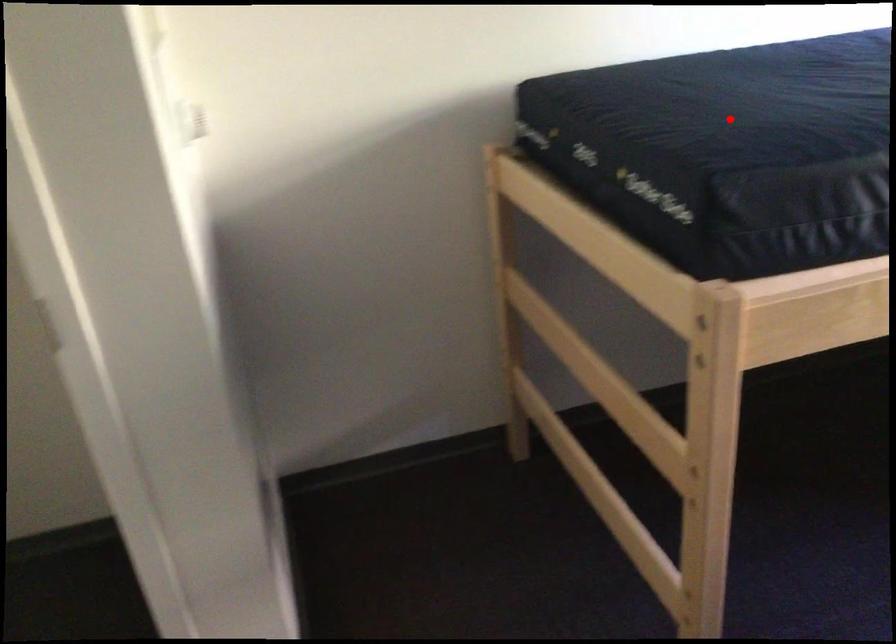
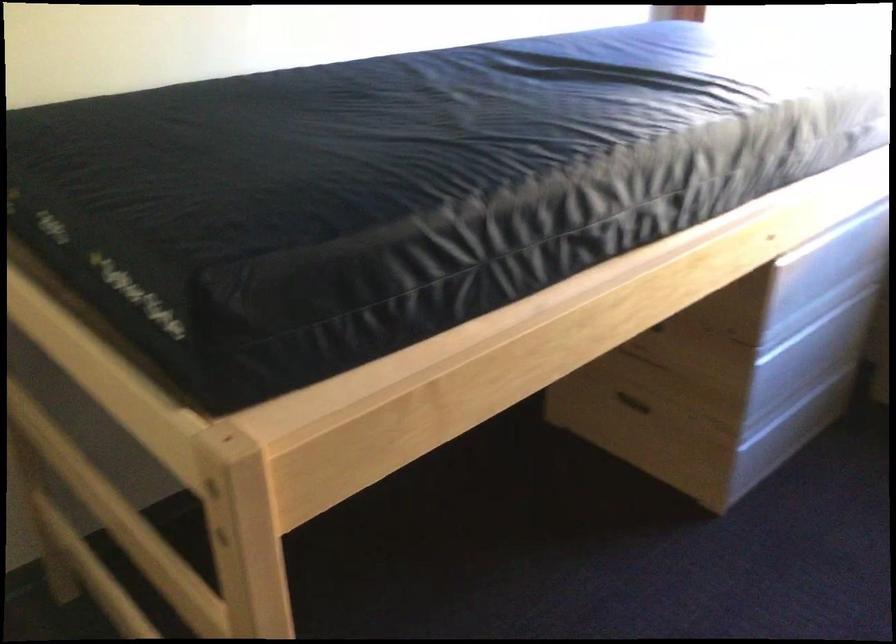
Question: I am providing you with two images of the same scene from different viewpoints. Given a red point in image1, look at the same physical point in image2. Is it:

Choices:
 (A) Closer to the viewpoint
 (B) Farther from the viewpoint

Answer: (A)